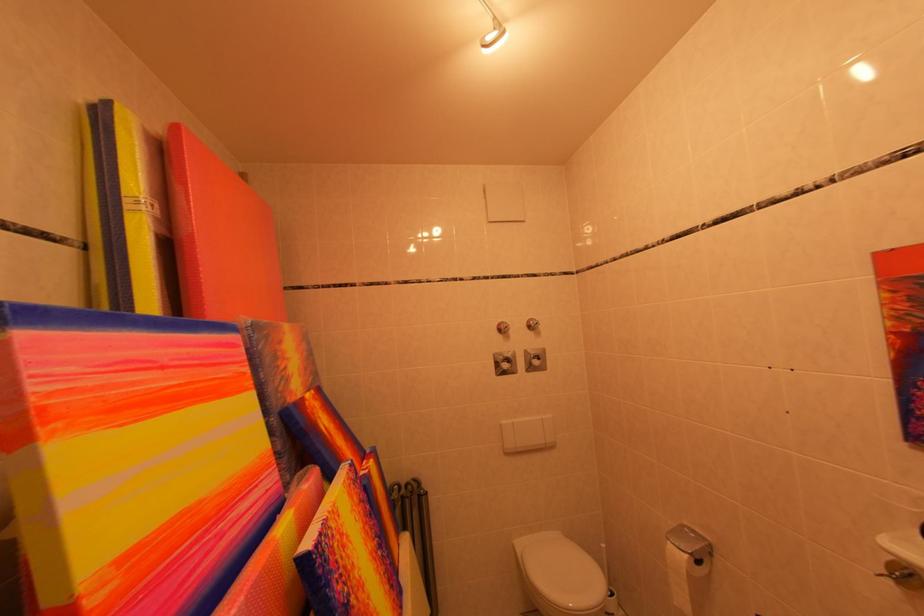
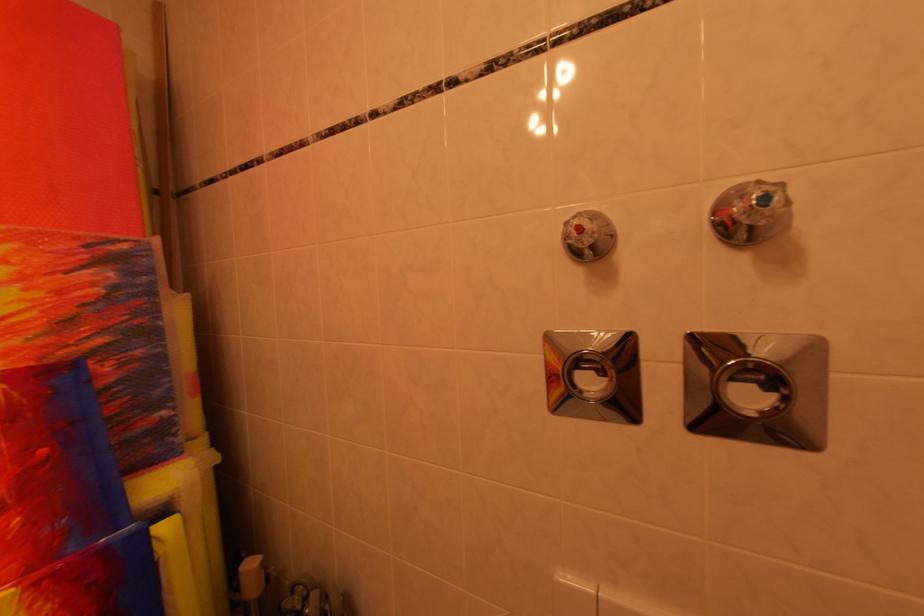
Locate, in the second image, the point that corresponds to (x=517, y=367) in the first image.

(608, 379)